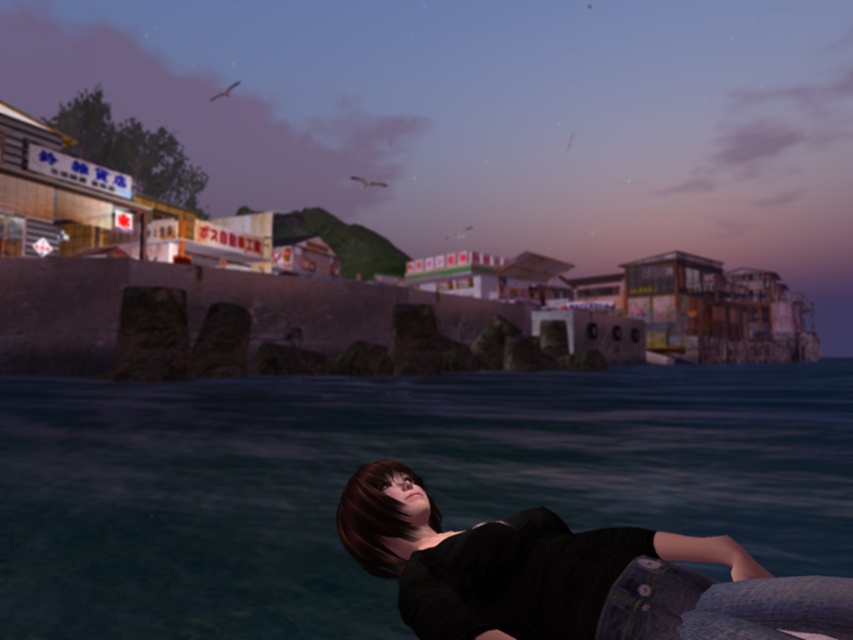
Question: Is smooth concrete wall at lower center bigger than denim jeans at lower right?

Choices:
 (A) yes
 (B) no

Answer: (A)

Question: Which point is farther to the camera?

Choices:
 (A) (584, 547)
 (B) (844, 234)
 (C) (689, 387)

Answer: (B)

Question: From the image, what is the correct spatial relationship of blue water at lower center in relation to denim jeans at lower right?

Choices:
 (A) right
 (B) left

Answer: (A)

Question: Which point is closer to the camera?

Choices:
 (A) smooth concrete wall at lower center
 (B) blue water at lower center
 (C) denim jeans at lower right

Answer: (C)

Question: Is smooth concrete wall at lower center to the left of denim jeans at lower right from the viewer's perspective?

Choices:
 (A) no
 (B) yes

Answer: (B)

Question: Which point is closer to the camera?

Choices:
 (A) (552, 513)
 (B) (421, 129)
 (C) (51, 528)

Answer: (A)